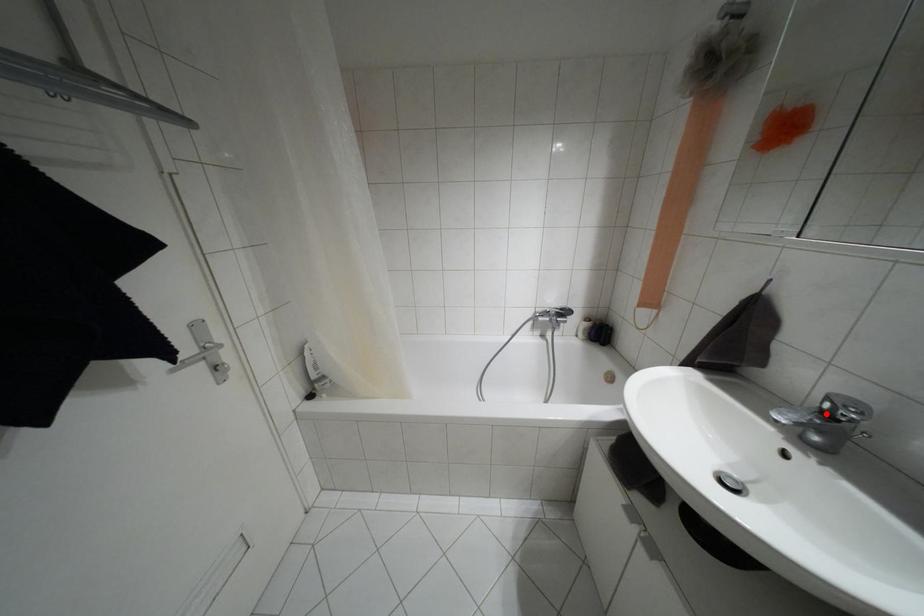
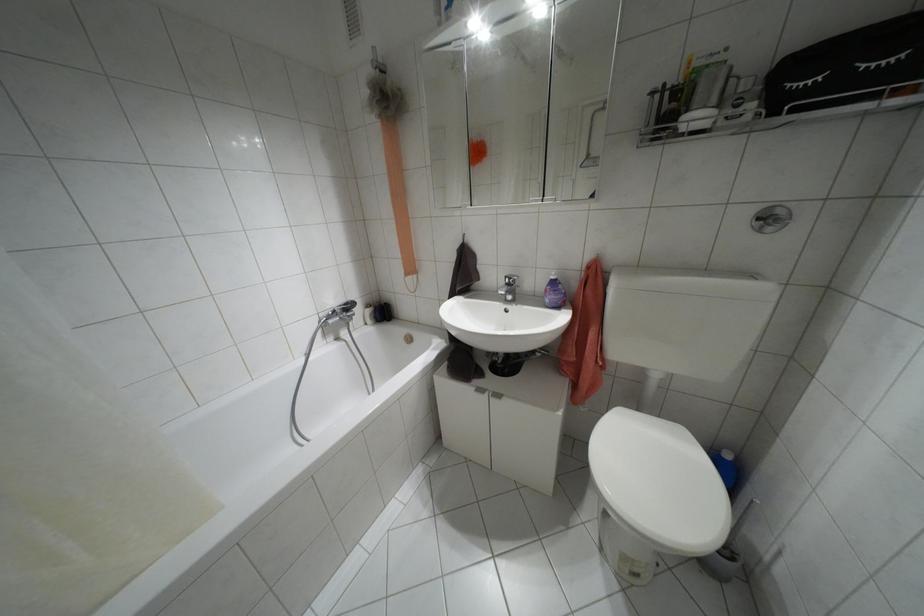
The point at the highlighted location is marked in the first image. Where is the corresponding point in the second image?

(507, 284)